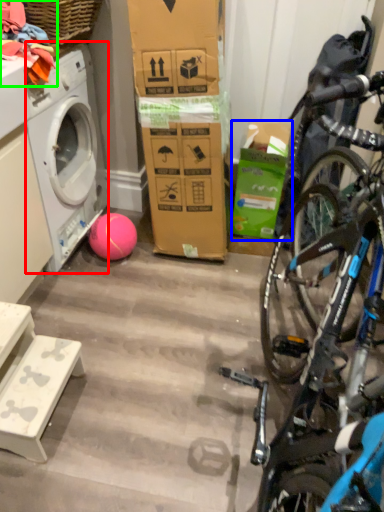
Question: Considering the real-world distances, which object is closest to washing machine (highlighted by a red box)? box (highlighted by a blue box) or clothing (highlighted by a green box).

Choices:
 (A) box
 (B) clothing

Answer: (B)